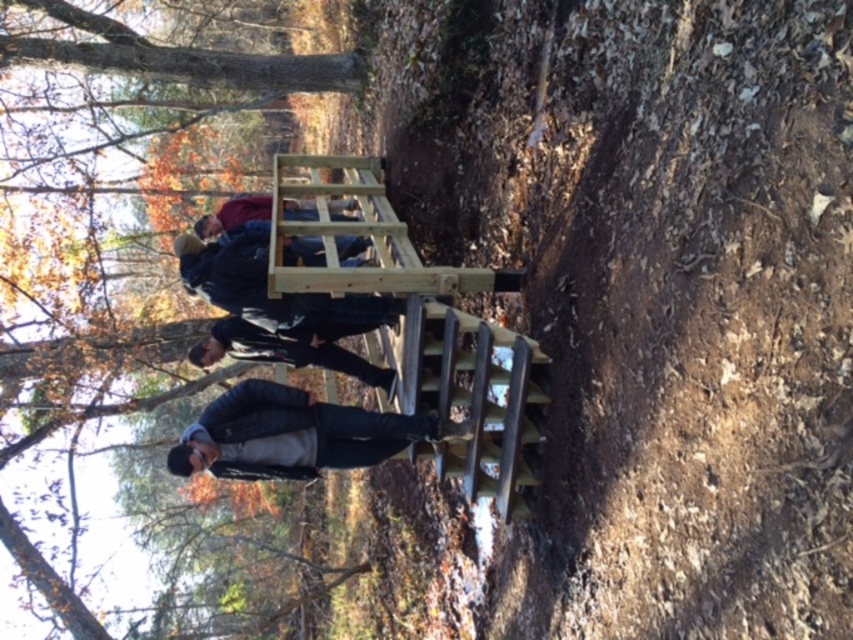
Question: Which object appears farthest from the camera in this image?

Choices:
 (A) black matte jacket at center
 (B) brown wood tree at upper center

Answer: (B)

Question: Is brown wood tree at upper center below black matte jacket at center?

Choices:
 (A) yes
 (B) no

Answer: (B)

Question: Can you confirm if dark gray leather jacket at center is bigger than matte black jacket at center?

Choices:
 (A) yes
 (B) no

Answer: (B)

Question: Based on their relative distances, which object is farther from the light brown wooden ladder at center?

Choices:
 (A) dark gray leather jacket at center
 (B) matte black jacket at center
 (C) black matte jacket at center

Answer: (B)

Question: Is brown wood tree at upper center smaller than light brown wooden ladder at center?

Choices:
 (A) yes
 (B) no

Answer: (A)

Question: Estimate the real-world distances between objects in this image. Which object is closer to the dark gray leather jacket at center?

Choices:
 (A) matte black jacket at center
 (B) light brown wooden ladder at center
 (C) brown wood tree at upper center
 (D) black matte jacket at center

Answer: (B)